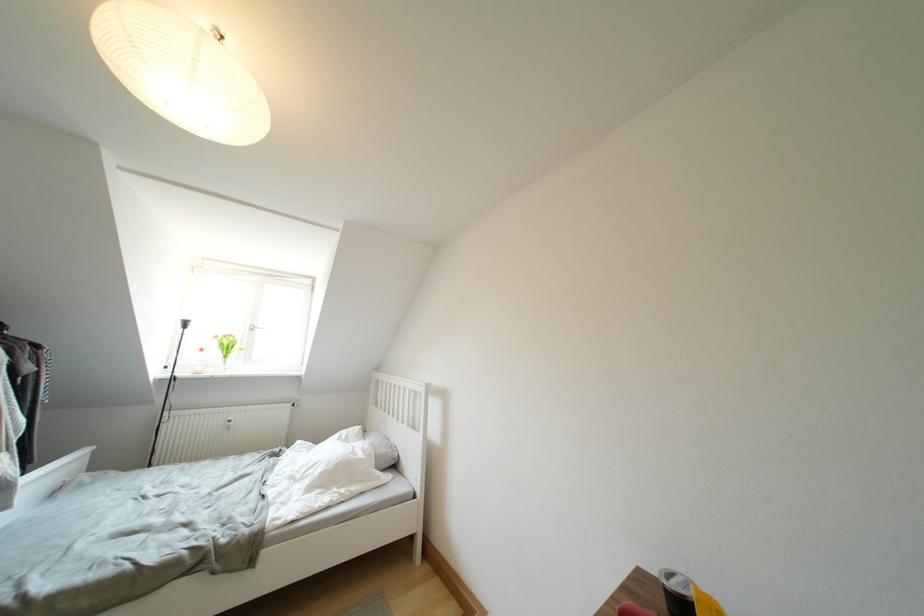
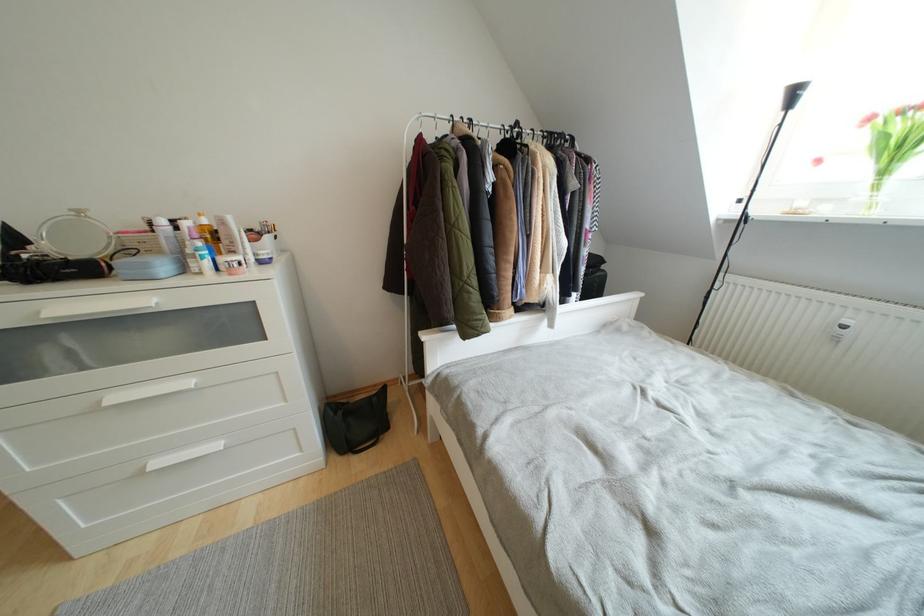
Find the pixel in the second image that matches the point at 231,361 in the first image.

(890, 176)